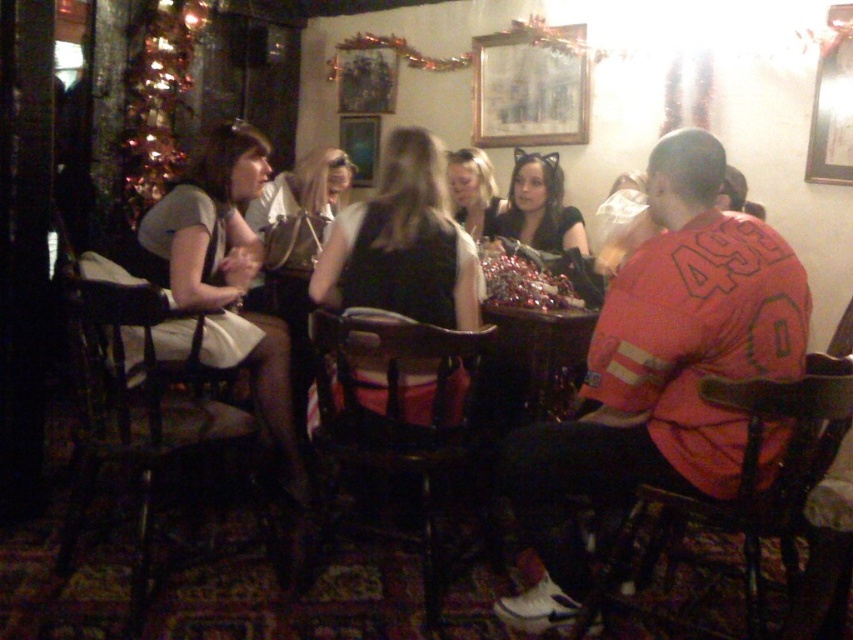
You are a guest at this festive event and need to choose between the black matte dress at center and the smooth black dress at center. Which one is bigger in size?

The black matte dress at center is larger in size than the smooth black dress at center.

You are a guest at this festive event and notice two black dresses at the center of the table. Which dress is placed lower on the table between the black matte dress at center and the smooth black dress at center?

The black matte dress at center is positioned under the smooth black dress at center, so the black matte dress at center is placed lower on the table.

You are standing in the bar and want to take a photo of both the festive tree and the table with the people sitting around it. Which point, point 1 at coordinates (515, 237) or point 2 at coordinates (497, 209), should you focus on to ensure both the tree and the table are in clear focus?

Point 1 at coordinates (515, 237) is closer to the camera than point 2 at coordinates (497, 209). Therefore, focusing on point 1 will help ensure both the festive tree in the background and the table with people are in clear focus.